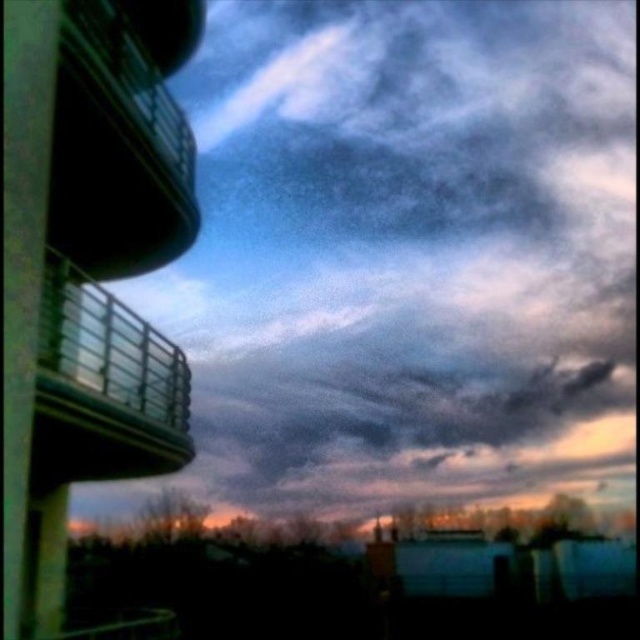
Question: Among these points, which one is farthest from the camera?

Choices:
 (A) (76, 65)
 (B) (106, 461)

Answer: (B)

Question: Where is metallic balcony at left located in relation to metallic glass balcony at upper left in the image?

Choices:
 (A) above
 (B) below

Answer: (A)

Question: Is metallic balcony at left to the right of metallic glass balcony at upper left from the viewer's perspective?

Choices:
 (A) yes
 (B) no

Answer: (B)

Question: Does metallic balcony at left appear over metallic glass balcony at upper left?

Choices:
 (A) no
 (B) yes

Answer: (B)